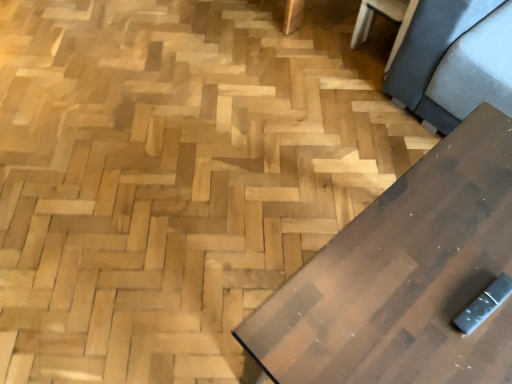
I want to click on dark brown wood coffee table at lower right, so click(x=404, y=277).

In order to face dark brown wood coffee table at lower right, should I rotate leftwards or rightwards?

Rotate right and turn 23.558 degrees.

The width and height of the screenshot is (512, 384). What do you see at coordinates (404, 277) in the screenshot?
I see `dark brown wood coffee table at lower right` at bounding box center [404, 277].

What is the approximate height of dark brown wood coffee table at lower right?

dark brown wood coffee table at lower right is 20.74 inches in height.

Locate an element on the screen. dark brown wood coffee table at lower right is located at coordinates (404, 277).